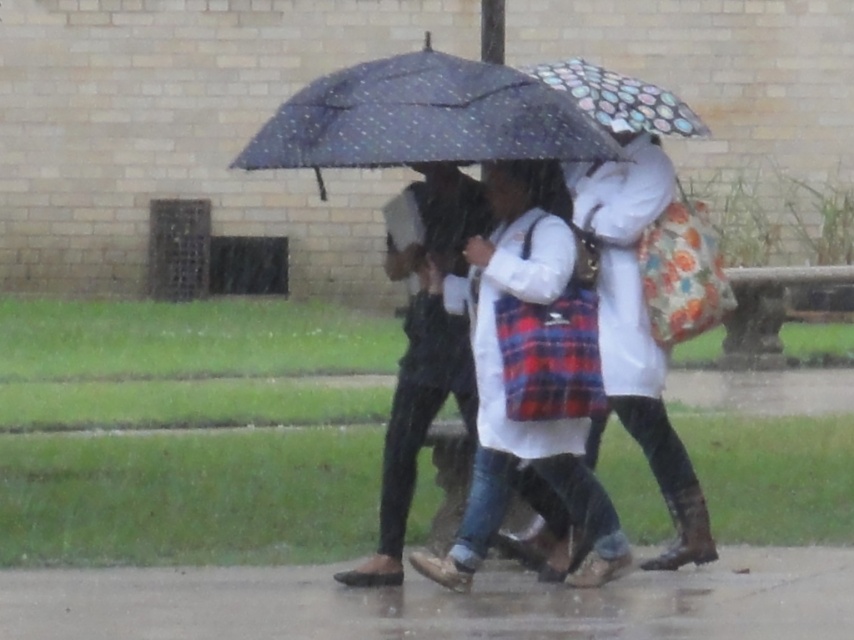
Is damp concrete pavement at lower center below polka dot fabric umbrella at center?

Correct, damp concrete pavement at lower center is located below polka dot fabric umbrella at center.

Is damp concrete pavement at lower center above polka dot fabric umbrella at center?

No, damp concrete pavement at lower center is not above polka dot fabric umbrella at center.

The height and width of the screenshot is (640, 854). Identify the location of damp concrete pavement at lower center. (439, 602).

Where is `damp concrete pavement at lower center`? This screenshot has width=854, height=640. damp concrete pavement at lower center is located at coordinates 439,602.

Describe the element at coordinates (424, 118) in the screenshot. I see `polka dot fabric umbrella at center` at that location.

Is polka dot fabric umbrella at center below polka dot fabric umbrella at upper center?

Yes, polka dot fabric umbrella at center is below polka dot fabric umbrella at upper center.

What do you see at coordinates (424, 118) in the screenshot? This screenshot has height=640, width=854. I see `polka dot fabric umbrella at center` at bounding box center [424, 118].

Find the location of a particular element. The width and height of the screenshot is (854, 640). polka dot fabric umbrella at center is located at coordinates (424, 118).

Can you confirm if damp concrete pavement at lower center is positioned above white cotton coat at center?

Incorrect, damp concrete pavement at lower center is not positioned above white cotton coat at center.

Measure the distance between point (x=717, y=620) and camera.

9.17 meters

Which is behind, point (583, 634) or point (413, 456)?

The point (413, 456) is more distant.

Locate an element on the screen. damp concrete pavement at lower center is located at coordinates (439, 602).